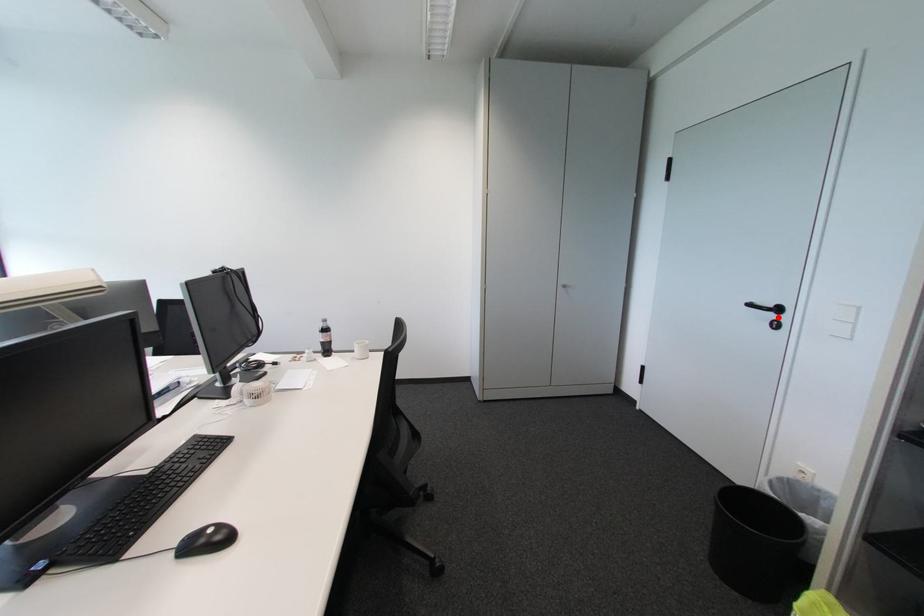
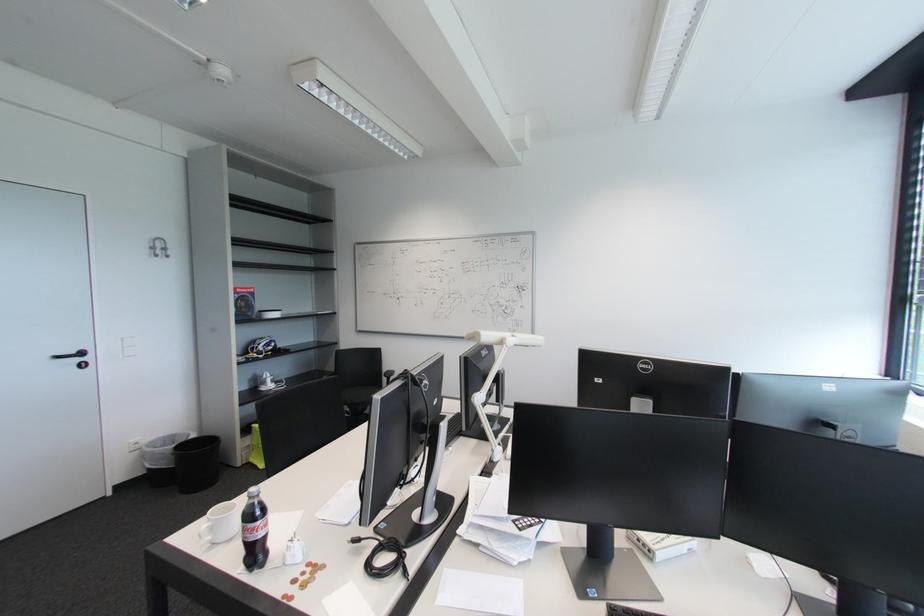
In the second image, find the point that corresponds to the highlighted location in the first image.

(83, 361)